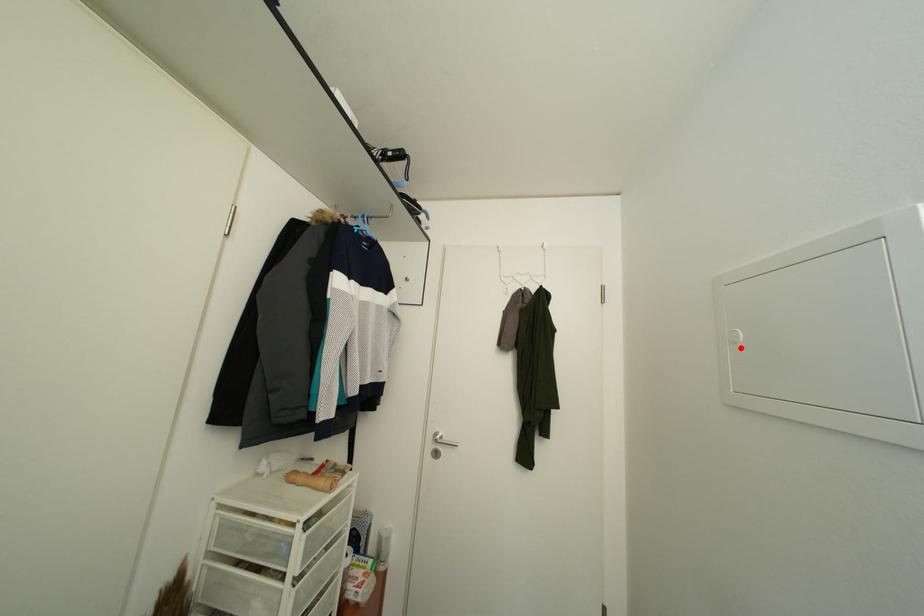
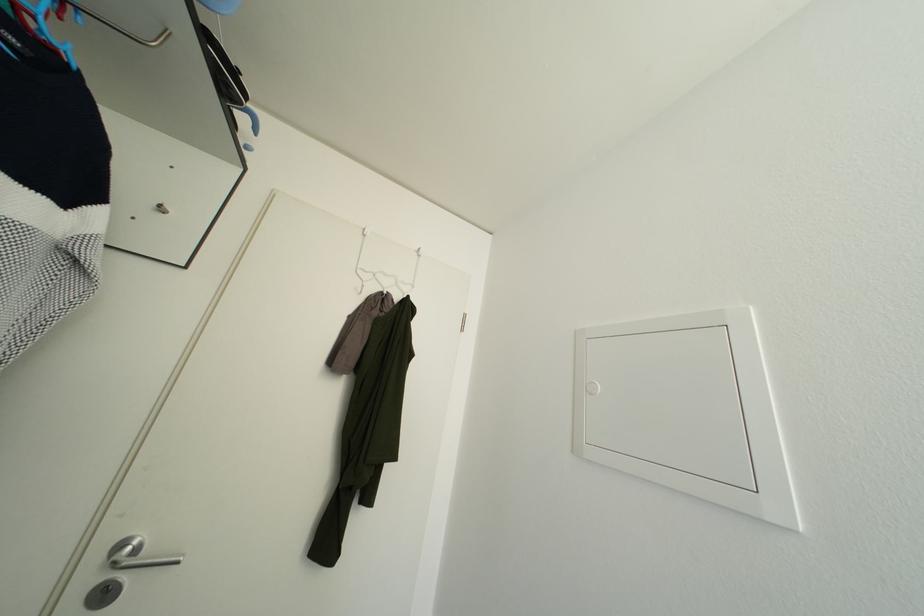
Where in the second image is the point corresponding to the highlighted location from the first image?

(598, 399)